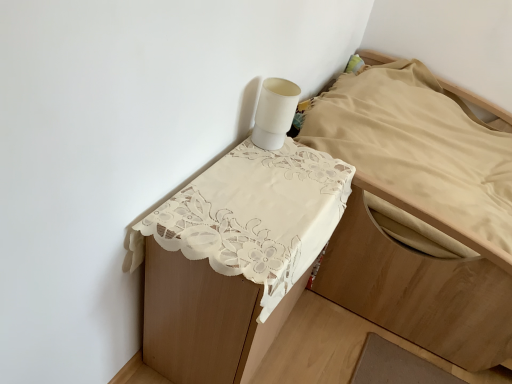
I want to click on vacant area on top of white lace tablecloth at upper center (from a real-world perspective), so click(271, 193).